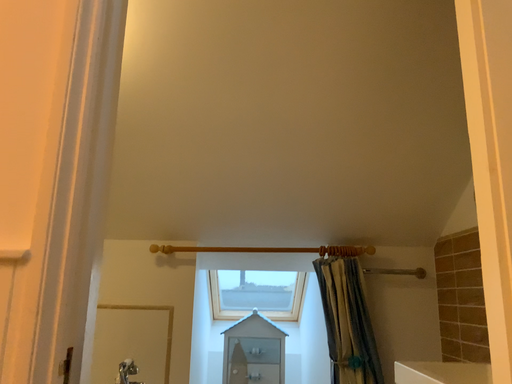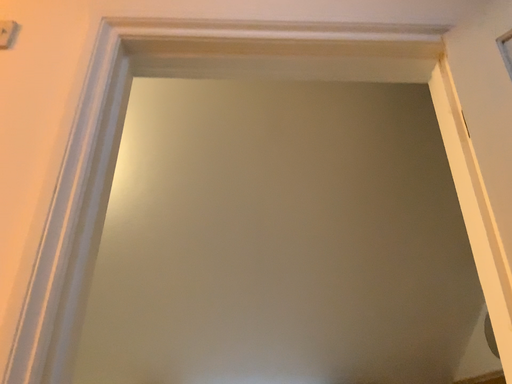
Question: Which way did the camera rotate in the video?

Choices:
 (A) rotated upward
 (B) rotated downward

Answer: (A)